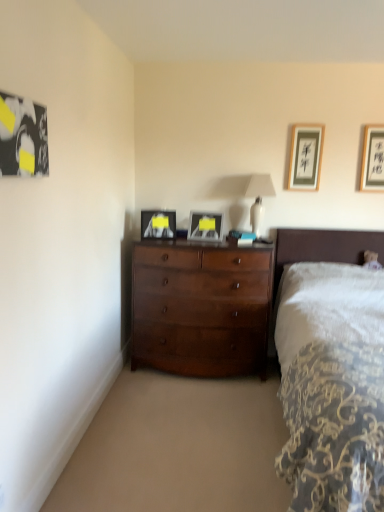
What is the approximate width of metallic silver picture frame at center, the third picture frame in the left-to-right sequence?

It is 3.78 inches.

Image resolution: width=384 pixels, height=512 pixels. What do you see at coordinates (23, 137) in the screenshot?
I see `black matte picture frame at upper left, acting as the fifth picture frame starting from the right` at bounding box center [23, 137].

This screenshot has height=512, width=384. Describe the element at coordinates (331, 372) in the screenshot. I see `dark wood bed at right` at that location.

What are the coordinates of `shiny brown dresser at center` in the screenshot? It's located at (200, 309).

Which object is further away from the camera, shiny brown dresser at center or metallic silver picture frame at center, the third picture frame in the left-to-right sequence?

Positioned behind is metallic silver picture frame at center, the third picture frame in the left-to-right sequence.

From the image's perspective, which one is positioned higher, shiny brown dresser at center or metallic silver picture frame at center, the fourth picture frame from the back?

From the image's view, metallic silver picture frame at center, the fourth picture frame from the back, is above.

In the scene shown: Which object is thinner, shiny brown dresser at center or metallic silver picture frame at center, which is counted as the second picture frame, starting from the front?

metallic silver picture frame at center, which is counted as the second picture frame, starting from the front, is thinner.

Looking at this image, does shiny brown dresser at center appear on the right side of metallic silver picture frame at center, which ranks as the third picture frame in right-to-left order?

No.

How much distance is there between black matte picture frame at upper left, which is counted as the first picture frame, starting from the front, and shiny brown dresser at center?

black matte picture frame at upper left, which is counted as the first picture frame, starting from the front, is 1.76 meters away from shiny brown dresser at center.

From the image's perspective, which is above, black matte picture frame at upper left, which is counted as the fifth picture frame, starting from the back, or shiny brown dresser at center?

black matte picture frame at upper left, which is counted as the fifth picture frame, starting from the back, is shown above in the image.

Does black matte picture frame at upper left, which appears as the first picture frame when viewed from the left, come in front of shiny brown dresser at center?

Yes, the depth of black matte picture frame at upper left, which appears as the first picture frame when viewed from the left, is less than that of shiny brown dresser at center.

From a real-world perspective, is black matte picture frame at upper left, which appears as the first picture frame when viewed from the left, above or below shiny brown dresser at center?

black matte picture frame at upper left, which appears as the first picture frame when viewed from the left, is situated higher than shiny brown dresser at center in the real world.

From the image's perspective, does white glossy table lamp at upper center appear higher than black wood picture frame at upper right, the fifth picture frame positioned from the left?

No, from the image's perspective, white glossy table lamp at upper center is not on top of black wood picture frame at upper right, the fifth picture frame positioned from the left.

Could you tell me if white glossy table lamp at upper center is facing black wood picture frame at upper right, which is counted as the 1th picture frame, starting from the right?

No, white glossy table lamp at upper center is not aimed at black wood picture frame at upper right, which is counted as the 1th picture frame, starting from the right.

Which is less distant, (270, 187) or (378, 188)?

Point (270, 187).

Is matte black picture frame at center, which ranks as the third picture frame in front-to-back order, situated inside dark wood bed at right or outside?

matte black picture frame at center, which ranks as the third picture frame in front-to-back order, cannot be found inside dark wood bed at right.

From the image's perspective, between matte black picture frame at center, placed as the 4th picture frame when sorted from right to left, and dark wood bed at right, which one is located above?

From the image's view, matte black picture frame at center, placed as the 4th picture frame when sorted from right to left, is above.

You are a GUI agent. You are given a task and a screenshot of the screen. Output one action in this format:
    pyautogui.click(x=<x>, y=<y>)
    Task: Click on the bed lying below the matte black picture frame at center, which is counted as the second picture frame, starting from the left (from the image's perspective)
    Image resolution: width=384 pixels, height=512 pixels.
    Given the screenshot: What is the action you would take?
    pyautogui.click(x=331, y=372)

Considering the positions of points (144, 222) and (298, 500), is point (144, 222) closer to camera compared to point (298, 500)?

No, (144, 222) is behind (298, 500).

Consider the image. Considering the relative positions of shiny brown dresser at center and white glossy table lamp at upper center in the image provided, is shiny brown dresser at center to the left or to the right of white glossy table lamp at upper center?

From the image, it's evident that shiny brown dresser at center is to the left of white glossy table lamp at upper center.

Does point (198, 353) lie in front of point (261, 224)?

Yes.

Based on the photo, from the image's perspective, which is below, shiny brown dresser at center or white glossy table lamp at upper center?

shiny brown dresser at center.

From a real-world perspective, is shiny brown dresser at center above or below white glossy table lamp at upper center?

shiny brown dresser at center is below white glossy table lamp at upper center.

Consider the image. Is black wood picture frame at upper right, which is counted as the 1th picture frame, starting from the right, aimed at white glossy table lamp at upper center?

No, black wood picture frame at upper right, which is counted as the 1th picture frame, starting from the right, is not facing towards white glossy table lamp at upper center.

From a real-world perspective, is black wood picture frame at upper right, which is counted as the 1th picture frame, starting from the right, positioned above or below white glossy table lamp at upper center?

black wood picture frame at upper right, which is counted as the 1th picture frame, starting from the right, is above white glossy table lamp at upper center.

Which of these two, black wood picture frame at upper right, the fifth picture frame positioned from the left, or white glossy table lamp at upper center, is thinner?

black wood picture frame at upper right, the fifth picture frame positioned from the left.

Is black wood picture frame at upper right, positioned as the 4th picture frame in front-to-back order, next to white glossy table lamp at upper center?

No, black wood picture frame at upper right, positioned as the 4th picture frame in front-to-back order, is not in contact with white glossy table lamp at upper center.

From a real-world perspective, which is physically above, shiny brown dresser at center or dark wood bed at right?

dark wood bed at right is physically above.

How far apart are shiny brown dresser at center and dark wood bed at right?

shiny brown dresser at center is 74.83 centimeters away from dark wood bed at right.

Would you consider shiny brown dresser at center to be distant from dark wood bed at right?

No, there isn't a large distance between shiny brown dresser at center and dark wood bed at right.

Can you confirm if shiny brown dresser at center is positioned to the left of dark wood bed at right?

Yes, shiny brown dresser at center is to the left of dark wood bed at right.

What are the coordinates of `the 1st picture frame above when counting from the shiny brown dresser at center (from the image's perspective)` in the screenshot? It's located at (205, 226).

Locate an element on the screen. the 2nd picture frame to the left of the shiny brown dresser at center, counting from the anchor's position is located at coordinates (23, 137).

When comparing their distances from white glossy table lamp at upper center, does dark wood bed at right or matte black picture frame at center, which ranks as the third picture frame in front-to-back order, seem closer?

matte black picture frame at center, which ranks as the third picture frame in front-to-back order, lies closer to white glossy table lamp at upper center than the other object.

Looking at the image, which one is located further to shiny brown dresser at center, dark wood bed at right or black matte picture frame at upper left, which is counted as the first picture frame, starting from the front?

Based on the image, black matte picture frame at upper left, which is counted as the first picture frame, starting from the front, appears to be further to shiny brown dresser at center.

Based on their spatial positions, is white glossy table lamp at upper center or metallic silver picture frame at center, the fourth picture frame from the back, further from matte black picture frame at center, marked as the 3th picture frame in a back-to-front arrangement?

The object further to matte black picture frame at center, marked as the 3th picture frame in a back-to-front arrangement, is white glossy table lamp at upper center.

From the image, which object appears to be farther from metallic silver picture frame at center, the fourth picture frame from the back, shiny brown dresser at center or white glossy table lamp at upper center?

shiny brown dresser at center is further to metallic silver picture frame at center, the fourth picture frame from the back.

Estimate the real-world distances between objects in this image. Which object is further from shiny brown dresser at center, black wood picture frame at upper right, the second picture frame from the back, or matte black picture frame at upper right, which is the fifth picture frame from front to back?

black wood picture frame at upper right, the second picture frame from the back, lies further to shiny brown dresser at center than the other object.

Based on their spatial positions, is matte black picture frame at center, placed as the 4th picture frame when sorted from right to left, or dark wood bed at right closer to shiny brown dresser at center?

matte black picture frame at center, placed as the 4th picture frame when sorted from right to left, is positioned closer to the anchor shiny brown dresser at center.

From the image, which object appears to be farther from white glossy table lamp at upper center, shiny brown dresser at center or black matte picture frame at upper left, which is counted as the first picture frame, starting from the front?

Among the two, black matte picture frame at upper left, which is counted as the first picture frame, starting from the front, is located further to white glossy table lamp at upper center.

Considering their positions, is white glossy table lamp at upper center positioned further to black matte picture frame at upper left, which appears as the first picture frame when viewed from the left, than black wood picture frame at upper right, which is counted as the 1th picture frame, starting from the right?

black wood picture frame at upper right, which is counted as the 1th picture frame, starting from the right, is positioned further to the anchor black matte picture frame at upper left, which appears as the first picture frame when viewed from the left.

Where is `the chest of drawers located between black matte picture frame at upper left, which appears as the first picture frame when viewed from the left, and black wood picture frame at upper right, the second picture frame from the back, in the left-right direction`? the chest of drawers located between black matte picture frame at upper left, which appears as the first picture frame when viewed from the left, and black wood picture frame at upper right, the second picture frame from the back, in the left-right direction is located at coordinates (200, 309).

I want to click on table lamp between metallic silver picture frame at center, which is counted as the second picture frame, starting from the front, and black wood picture frame at upper right, the fifth picture frame positioned from the left, in the horizontal direction, so click(x=258, y=198).

Locate an element on the screen. table lamp between matte black picture frame at center, placed as the 4th picture frame when sorted from right to left, and matte black picture frame at upper right, which is the fifth picture frame from front to back, in the horizontal direction is located at coordinates (258, 198).

The height and width of the screenshot is (512, 384). I want to click on table lamp located between black matte picture frame at upper left, which is counted as the fifth picture frame, starting from the back, and black wood picture frame at upper right, the fifth picture frame positioned from the left, in the left-right direction, so click(x=258, y=198).